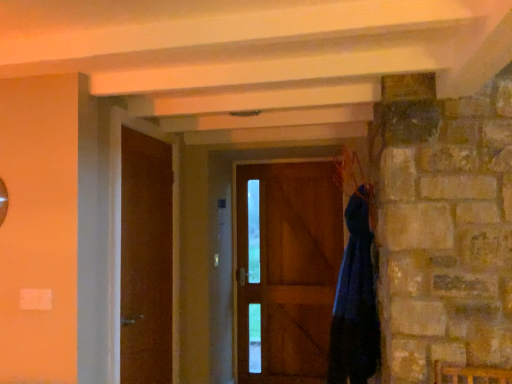
Question: Is dark blue fabric at right next to wooden door at center, acting as the first door starting from the back, and touching it?

Choices:
 (A) no
 (B) yes

Answer: (A)

Question: Is dark blue fabric at right looking in the opposite direction of wooden door at center, placed as the 1th door when sorted from right to left?

Choices:
 (A) yes
 (B) no

Answer: (B)

Question: Can you confirm if dark blue fabric at right is bigger than wooden door at center, placed as the 1th door when sorted from right to left?

Choices:
 (A) no
 (B) yes

Answer: (B)

Question: From the image's perspective, is dark blue fabric at right located beneath wooden door at center, the second door viewed from the front?

Choices:
 (A) yes
 (B) no

Answer: (B)

Question: Is dark blue fabric at right outside of wooden door at center, which is counted as the second door, starting from the left?

Choices:
 (A) yes
 (B) no

Answer: (A)

Question: Is dark blue fabric at right shorter than wooden door at center, the second door viewed from the front?

Choices:
 (A) no
 (B) yes

Answer: (B)

Question: From a real-world perspective, is dark blue fabric at right physically below matte brown door at left, which ranks as the first door in left-to-right order?

Choices:
 (A) yes
 (B) no

Answer: (A)

Question: From the image's perspective, would you say dark blue fabric at right is positioned over matte brown door at left, the 1th door positioned from the front?

Choices:
 (A) yes
 (B) no

Answer: (B)

Question: Does dark blue fabric at right have a smaller size compared to matte brown door at left, which ranks as the first door in left-to-right order?

Choices:
 (A) no
 (B) yes

Answer: (B)

Question: Is dark blue fabric at right positioned far away from matte brown door at left, which ranks as the second door in back-to-front order?

Choices:
 (A) yes
 (B) no

Answer: (A)

Question: Is dark blue fabric at right outside of matte brown door at left, the 1th door positioned from the front?

Choices:
 (A) no
 (B) yes

Answer: (B)

Question: Considering the relative positions of dark blue fabric at right and matte brown door at left, which ranks as the first door in left-to-right order, in the image provided, is dark blue fabric at right to the left of matte brown door at left, which ranks as the first door in left-to-right order, from the viewer's perspective?

Choices:
 (A) no
 (B) yes

Answer: (A)

Question: Is wooden door at center, the second door viewed from the front, outside of matte brown door at left, the 1th door positioned from the front?

Choices:
 (A) no
 (B) yes

Answer: (B)